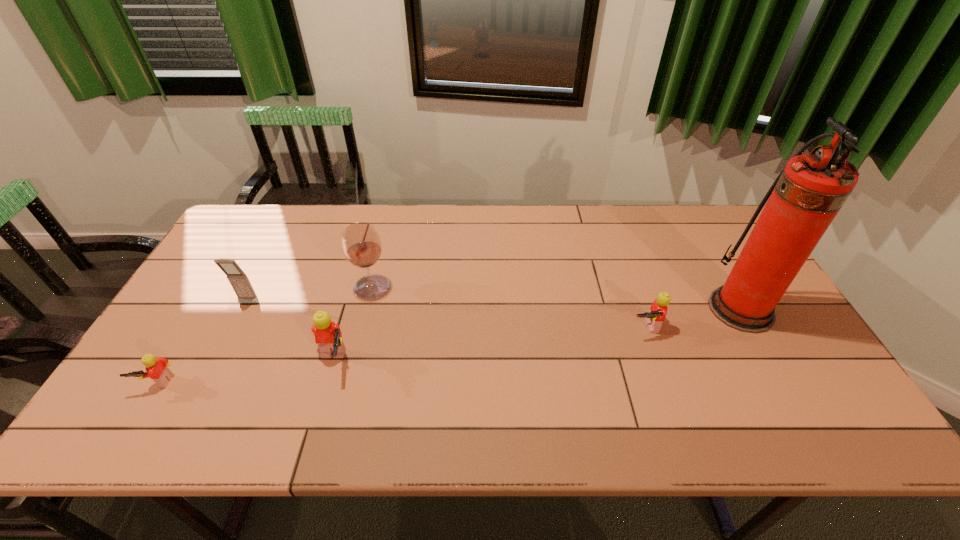
If equal spacing is the goal by inserting an additional Lego among them, please point out a vacant space for this new Lego. Please provide its 2D coordinates. Your answer should be formatted as a tuple, i.e. [(x, y)], where the tuple contains the x and y coordinates of a point satisfying the conditions above.

[(493, 344)]